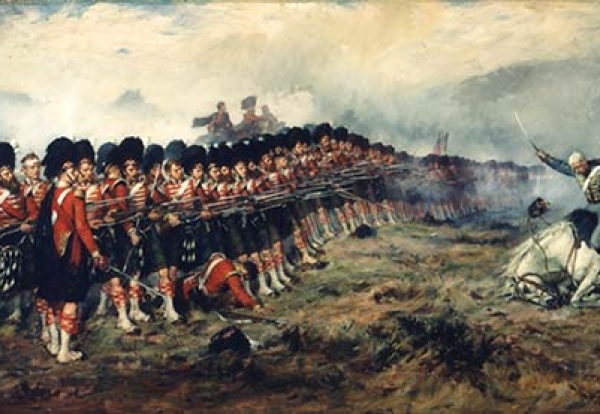
I want to click on painting, so click(336, 212).